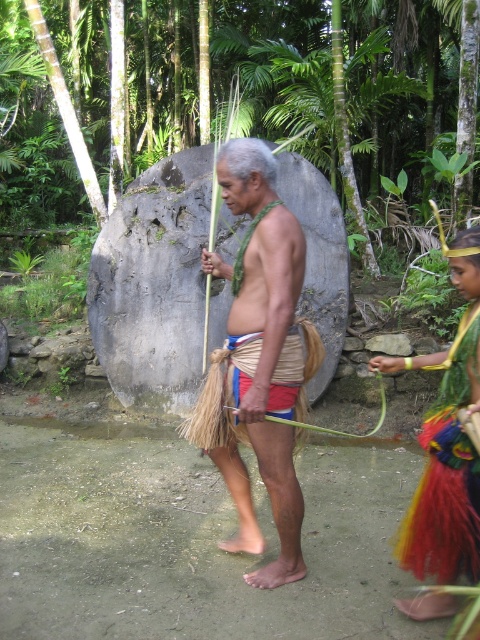
You are standing in the scene and want to move from the point at coordinates point (280, 272) to the point at coordinates point (479, 476). Which direction should you face to walk towards the second point?

You should face away from the camera because point (479, 476) is behind point (280, 272).

You are an explorer navigating through the forest and see the green leafy jungle at upper center and the multicolored woven skirt at right. Which object is positioned to the left side of the other?

The green leafy jungle at upper center is to the left of multicolored woven skirt at right.